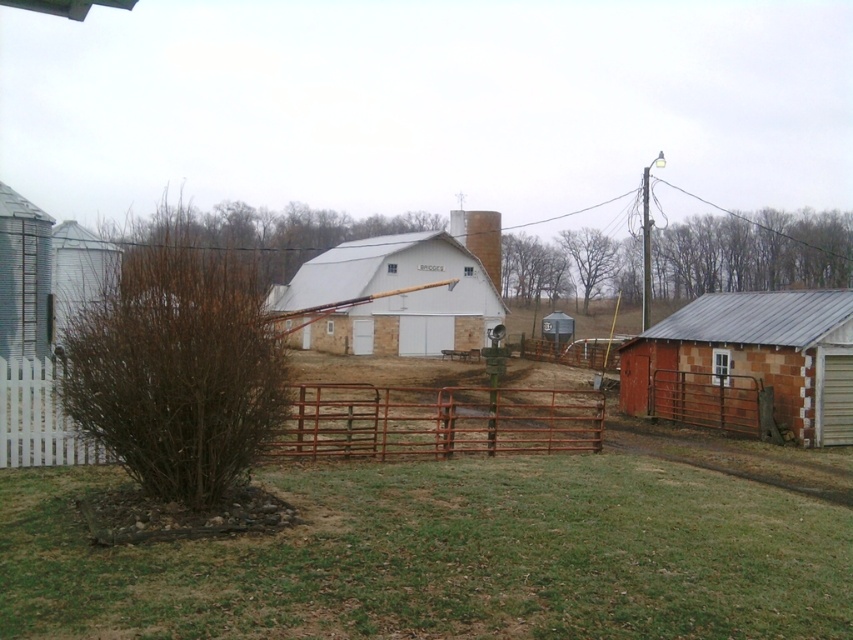
Can you confirm if rustic brick shed at right is thinner than brown wood chimney at center?

Yes.

Which of these two, rustic brick shed at right or brown wood chimney at center, stands shorter?

rustic brick shed at right

At what (x,y) coordinates should I click in order to perform the action: click on rustic brick shed at right. Please return your answer as a coordinate pair (x, y). The width and height of the screenshot is (853, 640). Looking at the image, I should click on (747, 364).

Where is `rustic brick shed at right`? Image resolution: width=853 pixels, height=640 pixels. rustic brick shed at right is located at coordinates (747, 364).

Is rusty metal gate at center positioned behind white matte barn at center?

Yes.

Can you confirm if rusty metal gate at center is positioned above white matte barn at center?

No, rusty metal gate at center is not above white matte barn at center.

What do you see at coordinates (436, 420) in the screenshot? Image resolution: width=853 pixels, height=640 pixels. I see `rusty metal gate at center` at bounding box center [436, 420].

The image size is (853, 640). I want to click on rusty metal gate at center, so click(436, 420).

Find the location of a particular element. This screenshot has width=853, height=640. white matte barn at center is located at coordinates (393, 296).

In the scene shown: Does white matte barn at center appear on the left side of brown wood chimney at center?

Indeed, white matte barn at center is positioned on the left side of brown wood chimney at center.

Which is in front, point (402, 337) or point (494, 256)?

Point (402, 337)

This screenshot has width=853, height=640. What are the coordinates of `white matte barn at center` in the screenshot? It's located at [393, 296].